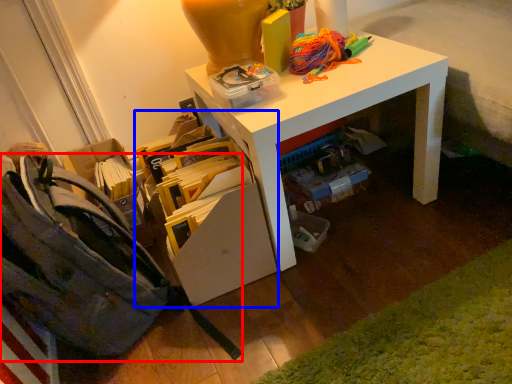
Question: Among these objects, which one is farthest to the camera, shoulder bag (highlighted by a red box) or shelf (highlighted by a blue box)?

Choices:
 (A) shoulder bag
 (B) shelf

Answer: (B)